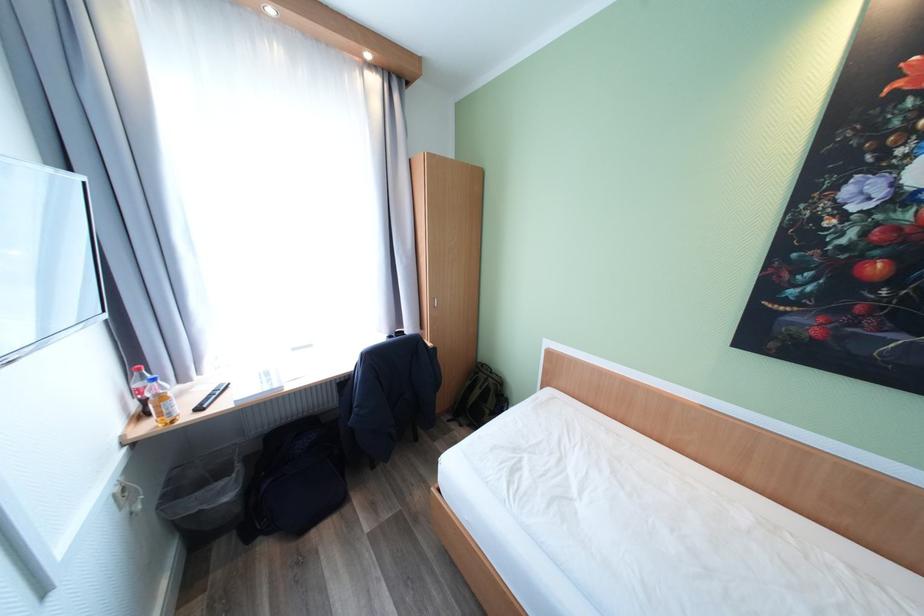
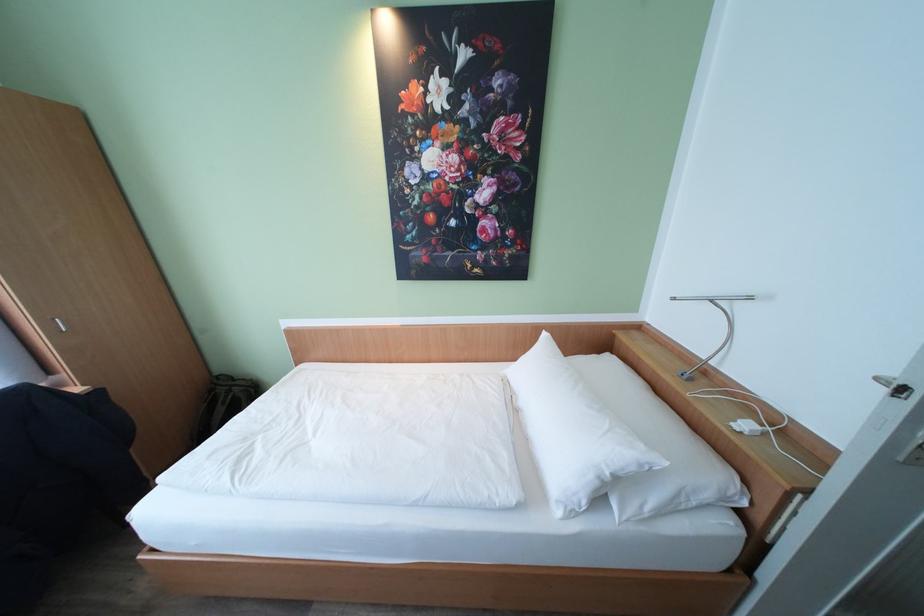
Question: The camera is either moving clockwise (left) or counter-clockwise (right) around the object. The first image is from the beginning of the video and the second image is from the end. Is the camera moving left or right when shooting the video?

Choices:
 (A) Left
 (B) Right

Answer: (A)